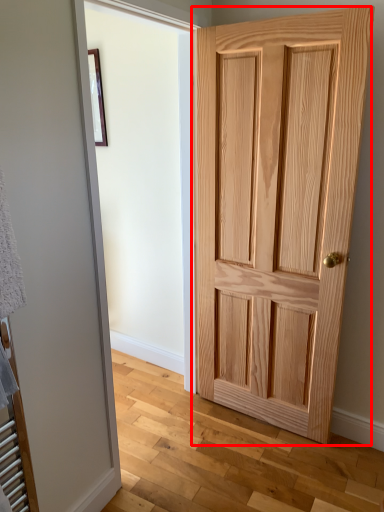
Question: From the image, what is the correct spatial relationship of door (annotated by the red box) in relation to picture frame?

Choices:
 (A) left
 (B) right

Answer: (B)